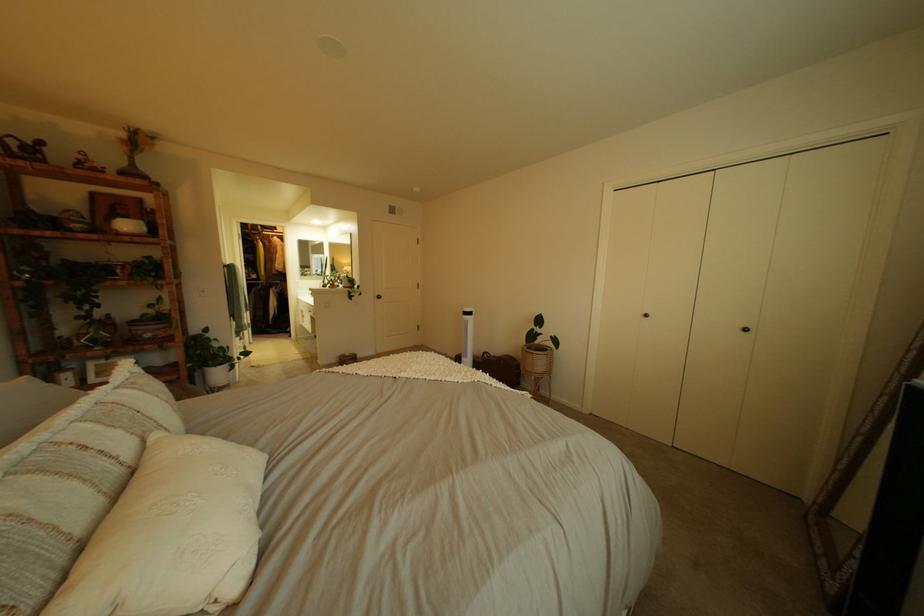
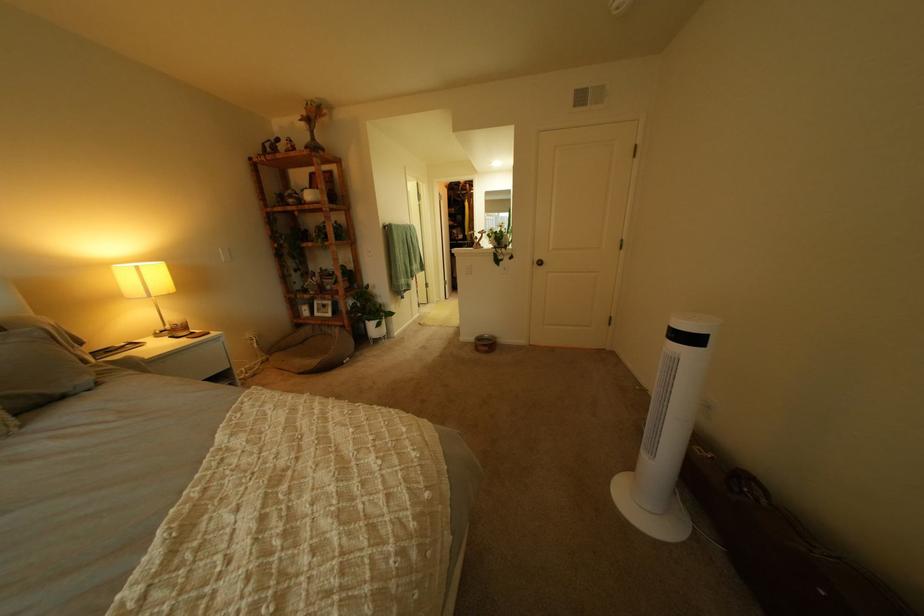
The point at (348, 362) is marked in the first image. Where is the corresponding point in the second image?

(489, 339)